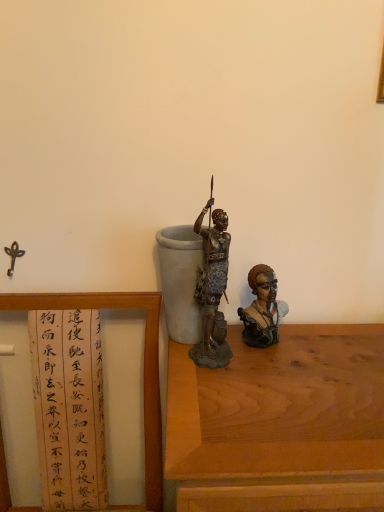
Where is `bronze statue at center, the second person when ordered from right to left`? This screenshot has height=512, width=384. bronze statue at center, the second person when ordered from right to left is located at coordinates (212, 270).

Image resolution: width=384 pixels, height=512 pixels. Describe the element at coordinates (144, 364) in the screenshot. I see `wooden framed paper at left` at that location.

Find the location of a particular element. The image size is (384, 512). bronze statue at center, the first person in the left-to-right sequence is located at coordinates (212, 270).

Which object is closer to the camera, bronze statue at center, the second person when ordered from right to left, or matte brown bust at right, marked as the 2th person in a left-to-right arrangement?

Positioned in front is bronze statue at center, the second person when ordered from right to left.

Is bronze statue at center, the second person when ordered from right to left, located outside matte brown bust at right, which is counted as the 1th person, starting from the right?

That's correct, bronze statue at center, the second person when ordered from right to left, is outside of matte brown bust at right, which is counted as the 1th person, starting from the right.

Can you confirm if bronze statue at center, the second person when ordered from right to left, is bigger than matte brown bust at right, marked as the 2th person in a left-to-right arrangement?

Yes, bronze statue at center, the second person when ordered from right to left, is bigger than matte brown bust at right, marked as the 2th person in a left-to-right arrangement.

How much distance is there between bronze statue at center, the second person when ordered from right to left, and matte brown bust at right, which is counted as the 1th person, starting from the right?

bronze statue at center, the second person when ordered from right to left, and matte brown bust at right, which is counted as the 1th person, starting from the right, are 4.41 inches apart.

Consider the image. Between wooden framed paper at left and matte brown bust at right, which is counted as the 1th person, starting from the right, which one has more height?

Standing taller between the two is wooden framed paper at left.

Considering the sizes of objects wooden framed paper at left and matte brown bust at right, which is counted as the 1th person, starting from the right, in the image provided, who is bigger, wooden framed paper at left or matte brown bust at right, which is counted as the 1th person, starting from the right,?

Bigger between the two is wooden framed paper at left.

Is the position of wooden framed paper at left less distant than that of matte brown bust at right, which is counted as the 1th person, starting from the right?

That is True.

Based on the photo, which of these two, wooden framed paper at left or matte brown bust at right, marked as the 2th person in a left-to-right arrangement, is thinner?

With smaller width is matte brown bust at right, marked as the 2th person in a left-to-right arrangement.

Considering the sizes of objects matte brown bust at right, which is counted as the 1th person, starting from the right, and bronze statue at center, the second person when ordered from right to left, in the image provided, who is wider, matte brown bust at right, which is counted as the 1th person, starting from the right, or bronze statue at center, the second person when ordered from right to left,?

Wider between the two is bronze statue at center, the second person when ordered from right to left.

Which of these two, matte brown bust at right, marked as the 2th person in a left-to-right arrangement, or bronze statue at center, the second person when ordered from right to left, is bigger?

bronze statue at center, the second person when ordered from right to left, is bigger.

Is matte brown bust at right, marked as the 2th person in a left-to-right arrangement, turned away from bronze statue at center, the second person when ordered from right to left?

No, bronze statue at center, the second person when ordered from right to left, is not at the back of matte brown bust at right, marked as the 2th person in a left-to-right arrangement.

Considering the positions of points (266, 289) and (216, 287), is point (266, 289) closer to camera compared to point (216, 287)?

That is False.

Is wooden table at center aimed at bronze statue at center, the second person when ordered from right to left?

No, wooden table at center is not facing towards bronze statue at center, the second person when ordered from right to left.

From the picture: From the image's perspective, which is above, wooden table at center or bronze statue at center, the second person when ordered from right to left?

From the image's view, bronze statue at center, the second person when ordered from right to left, is above.

Could bronze statue at center, the second person when ordered from right to left, be considered to be inside wooden table at center?

Definitely not — bronze statue at center, the second person when ordered from right to left, is not inside wooden table at center.

Based on their sizes in the image, would you say wooden table at center is bigger or smaller than bronze statue at center, the first person in the left-to-right sequence?

In the image, wooden table at center appears to be larger than bronze statue at center, the first person in the left-to-right sequence.

Can you confirm if matte brown bust at right, which is counted as the 1th person, starting from the right, is taller than wooden table at center?

In fact, matte brown bust at right, which is counted as the 1th person, starting from the right, may be shorter than wooden table at center.

Is matte brown bust at right, which is counted as the 1th person, starting from the right, far from wooden table at center?

No, there isn't a large distance between matte brown bust at right, which is counted as the 1th person, starting from the right, and wooden table at center.

Does matte brown bust at right, which is counted as the 1th person, starting from the right, have a smaller size compared to wooden table at center?

Yes, matte brown bust at right, which is counted as the 1th person, starting from the right, is smaller than wooden table at center.

Is point (263, 328) closer or farther from the camera than point (235, 433)?

Point (263, 328) is farther from the camera than point (235, 433).

Relative to wooden framed paper at left, is wooden table at center in front or behind?

Clearly, wooden table at center is behind wooden framed paper at left.

Is wooden table at center oriented towards wooden framed paper at left?

No, wooden table at center is not aimed at wooden framed paper at left.

Is wooden table at center positioned far away from wooden framed paper at left?

No, wooden table at center is not far from wooden framed paper at left.

From a real-world perspective, is wooden table at center physically located above or below wooden framed paper at left?

wooden table at center is situated lower than wooden framed paper at left in the real world.

Considering the sizes of objects matte brown bust at right, marked as the 2th person in a left-to-right arrangement, and wooden framed paper at left in the image provided, who is thinner, matte brown bust at right, marked as the 2th person in a left-to-right arrangement, or wooden framed paper at left?

With smaller width is matte brown bust at right, marked as the 2th person in a left-to-right arrangement.

From the picture: Is matte brown bust at right, which is counted as the 1th person, starting from the right, looking in the opposite direction of wooden framed paper at left?

No, matte brown bust at right, which is counted as the 1th person, starting from the right,'s orientation is not away from wooden framed paper at left.

Can you confirm if matte brown bust at right, marked as the 2th person in a left-to-right arrangement, is bigger than wooden framed paper at left?

Incorrect, matte brown bust at right, marked as the 2th person in a left-to-right arrangement, is not larger than wooden framed paper at left.

Does point (272, 303) lie in front of point (149, 342)?

That is True.

In order to click on person above the matte brown bust at right, which is counted as the 1th person, starting from the right (from a real-world perspective) in this screenshot , I will do `click(212, 270)`.

You are a GUI agent. You are given a task and a screenshot of the screen. Output one action in this format:
    pyautogui.click(x=<x>, y=<y>)
    Task: Click on the furniture on the left of matte brown bust at right, marked as the 2th person in a left-to-right arrangement
    Image resolution: width=384 pixels, height=512 pixels.
    Given the screenshot: What is the action you would take?
    pyautogui.click(x=144, y=364)

When comparing their distances from wooden table at center, does bronze statue at center, the second person when ordered from right to left, or wooden framed paper at left seem further?

wooden framed paper at left is further to wooden table at center.

Considering their positions, is bronze statue at center, the second person when ordered from right to left, positioned closer to matte brown bust at right, marked as the 2th person in a left-to-right arrangement, than wooden table at center?

The object closer to matte brown bust at right, marked as the 2th person in a left-to-right arrangement, is bronze statue at center, the second person when ordered from right to left.

Based on their spatial positions, is wooden framed paper at left or matte brown bust at right, which is counted as the 1th person, starting from the right, closer to bronze statue at center, the second person when ordered from right to left?

matte brown bust at right, which is counted as the 1th person, starting from the right, lies closer to bronze statue at center, the second person when ordered from right to left, than the other object.

When comparing their distances from wooden table at center, does wooden framed paper at left or bronze statue at center, the first person in the left-to-right sequence, seem closer?

The object closer to wooden table at center is bronze statue at center, the first person in the left-to-right sequence.

Looking at the image, which one is located further to wooden table at center, matte brown bust at right, marked as the 2th person in a left-to-right arrangement, or bronze statue at center, the first person in the left-to-right sequence?

The object further to wooden table at center is bronze statue at center, the first person in the left-to-right sequence.

Estimate the real-world distances between objects in this image. Which object is further from matte brown bust at right, which is counted as the 1th person, starting from the right, wooden framed paper at left or wooden table at center?

The object further to matte brown bust at right, which is counted as the 1th person, starting from the right, is wooden framed paper at left.

Which object lies further to the anchor point wooden framed paper at left, wooden table at center or matte brown bust at right, which is counted as the 1th person, starting from the right?

wooden table at center is positioned further to the anchor wooden framed paper at left.

Considering their positions, is wooden table at center positioned further to matte brown bust at right, which is counted as the 1th person, starting from the right, than bronze statue at center, the first person in the left-to-right sequence?

Based on the image, wooden table at center appears to be further to matte brown bust at right, which is counted as the 1th person, starting from the right.

Find the location of a particular element. The height and width of the screenshot is (512, 384). person between bronze statue at center, the second person when ordered from right to left, and wooden framed paper at left, in the vertical direction is located at coordinates (262, 309).

This screenshot has width=384, height=512. Identify the location of furniture between bronze statue at center, the first person in the left-to-right sequence, and wooden table at center vertically. (144, 364).

I want to click on person that lies between bronze statue at center, the first person in the left-to-right sequence, and wooden table at center from top to bottom, so click(262, 309).